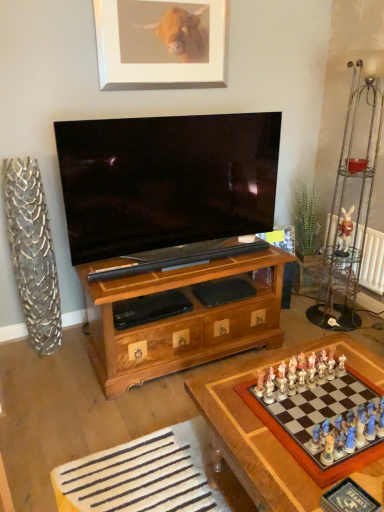
Question: From a real-world perspective, is white ceramic rabbit at upper right physically below wooden chessboard at lower right?

Choices:
 (A) yes
 (B) no

Answer: (B)

Question: Considering the relative sizes of white ceramic rabbit at upper right and wooden chessboard at lower right in the image provided, is white ceramic rabbit at upper right shorter than wooden chessboard at lower right?

Choices:
 (A) yes
 (B) no

Answer: (A)

Question: Can you confirm if white ceramic rabbit at upper right is bigger than wooden chessboard at lower right?

Choices:
 (A) no
 (B) yes

Answer: (A)

Question: Does white ceramic rabbit at upper right contain wooden chessboard at lower right?

Choices:
 (A) no
 (B) yes

Answer: (A)

Question: Are white ceramic rabbit at upper right and wooden chessboard at lower right located far from each other?

Choices:
 (A) no
 (B) yes

Answer: (B)

Question: Does white ceramic rabbit at upper right come in front of wooden chessboard at lower right?

Choices:
 (A) yes
 (B) no

Answer: (B)

Question: Considering the relative sizes of silver metallic picture frame at upper center and wooden chessboard at lower right in the image provided, is silver metallic picture frame at upper center wider than wooden chessboard at lower right?

Choices:
 (A) yes
 (B) no

Answer: (B)

Question: Would you say silver metallic picture frame at upper center is outside wooden chessboard at lower right?

Choices:
 (A) no
 (B) yes

Answer: (B)

Question: From the image's perspective, is silver metallic picture frame at upper center on wooden chessboard at lower right?

Choices:
 (A) no
 (B) yes

Answer: (B)

Question: Does silver metallic picture frame at upper center have a larger size compared to wooden chessboard at lower right?

Choices:
 (A) yes
 (B) no

Answer: (B)

Question: Can you confirm if silver metallic picture frame at upper center is thinner than wooden chessboard at lower right?

Choices:
 (A) no
 (B) yes

Answer: (B)

Question: Are silver metallic picture frame at upper center and wooden chessboard at lower right far apart?

Choices:
 (A) yes
 (B) no

Answer: (A)

Question: Does wooden chessboard at lower right have a larger size compared to white ceramic rabbit at upper right?

Choices:
 (A) no
 (B) yes

Answer: (B)